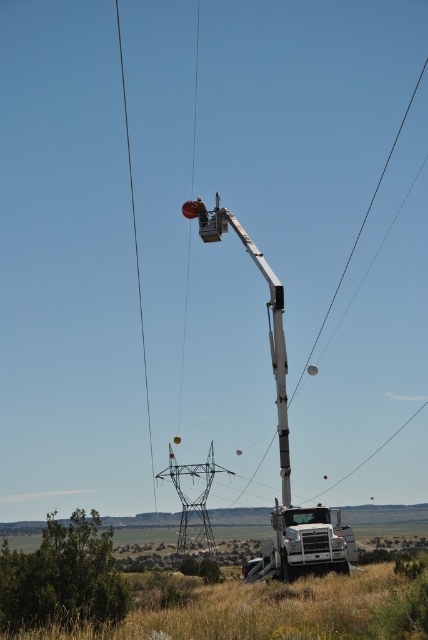
Describe the element at coordinates (303, 544) in the screenshot. I see `matte white trailer truck at lower right` at that location.

Does matte white trailer truck at lower right have a lesser width compared to white metallic crane at center?

Indeed, matte white trailer truck at lower right has a lesser width compared to white metallic crane at center.

Where is `matte white trailer truck at lower right`? The image size is (428, 640). matte white trailer truck at lower right is located at coordinates (303, 544).

What are the coordinates of `matte white trailer truck at lower right` in the screenshot? It's located at (303, 544).

Can you confirm if dry grass at lower right is shorter than metallic gray tower at center?

Yes.

Does dry grass at lower right have a greater width compared to metallic gray tower at center?

Indeed, dry grass at lower right has a greater width compared to metallic gray tower at center.

The image size is (428, 640). Find the location of `dry grass at lower right`. dry grass at lower right is located at coordinates (265, 609).

Does matte white trailer truck at lower right lie in front of metallic gray tower at center?

Yes, it is.

Looking at this image, is matte white trailer truck at lower right bigger than metallic gray tower at center?

Incorrect, matte white trailer truck at lower right is not larger than metallic gray tower at center.

What are the coordinates of `matte white trailer truck at lower right` in the screenshot? It's located at (303, 544).

This screenshot has width=428, height=640. I want to click on matte white trailer truck at lower right, so click(x=303, y=544).